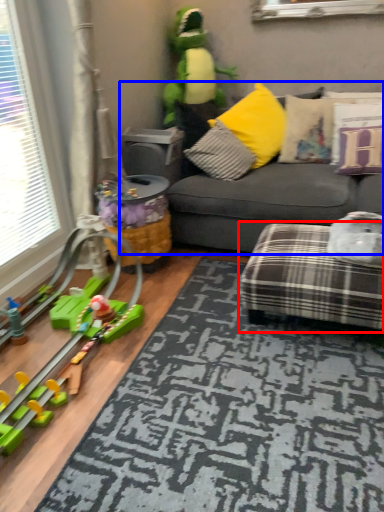
Question: Among these objects, which one is nearest to the camera, studio couch (highlighted by a red box) or studio couch (highlighted by a blue box)?

Choices:
 (A) studio couch
 (B) studio couch

Answer: (A)